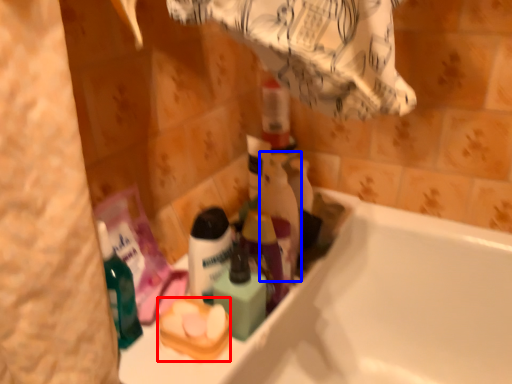
Question: Which object appears farthest to the camera in this image, product (highlighted by a red box) or cleaning product (highlighted by a blue box)?

Choices:
 (A) product
 (B) cleaning product

Answer: (B)